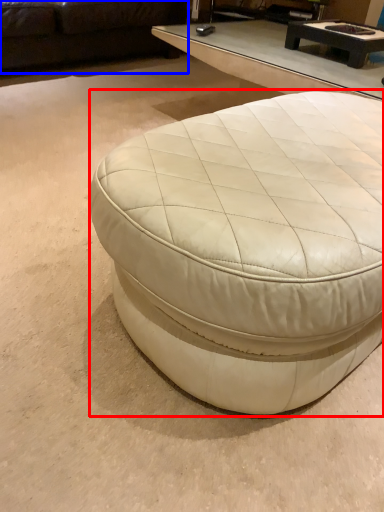
Question: Which point is closer to the camera, coffee table (highlighted by a red box) or studio couch (highlighted by a blue box)?

Choices:
 (A) coffee table
 (B) studio couch

Answer: (A)